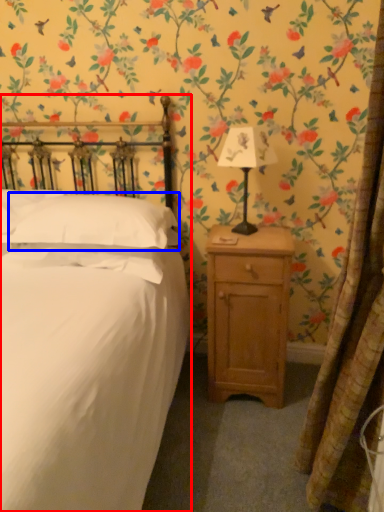
Question: Which object is further to the camera taking this photo, bed (highlighted by a red box) or pillow (highlighted by a blue box)?

Choices:
 (A) bed
 (B) pillow

Answer: (B)